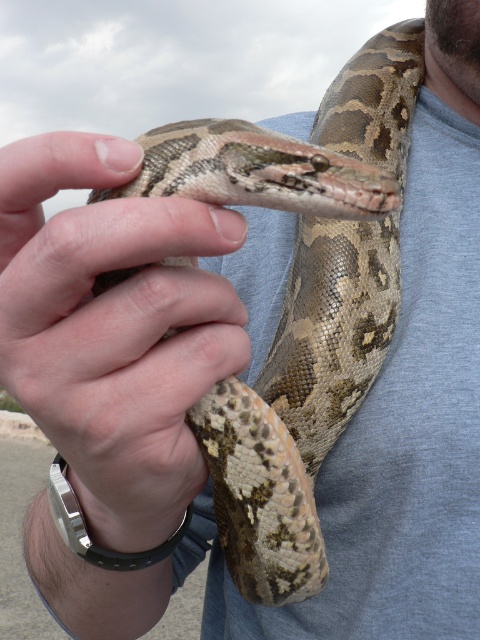
Does point (231, 232) come in front of point (450, 97)?

Yes.

Can you confirm if leathery tan snake at center is thinner than skinny neck at upper center?

In fact, leathery tan snake at center might be wider than skinny neck at upper center.

The image size is (480, 640). I want to click on leathery tan snake at center, so click(113, 330).

You are a GUI agent. You are given a task and a screenshot of the screen. Output one action in this format:
    pyautogui.click(x=<x>, y=<y>)
    Task: Click on the leathery tan snake at center
    The width and height of the screenshot is (480, 640).
    Given the screenshot: What is the action you would take?
    pyautogui.click(x=113, y=330)

Is camouflage-patterned snake at center to the left of leathery tan snake at center from the viewer's perspective?

Incorrect, camouflage-patterned snake at center is not on the left side of leathery tan snake at center.

Does point (299, 556) lie behind point (86, 298)?

Yes, point (299, 556) is farther from viewer.

At what (x,y) coordinates should I click in order to perform the action: click on camouflage-patterned snake at center. Please return your answer as a coordinate pair (x, y). The image size is (480, 640). Looking at the image, I should click on (300, 300).

Between camouflage-patterned snake at center and skinny neck at upper center, which one is positioned lower?

camouflage-patterned snake at center is below.

Locate an element on the screen. The height and width of the screenshot is (640, 480). camouflage-patterned snake at center is located at coordinates (300, 300).

Which is in front, point (269, 557) or point (460, 115)?

Point (269, 557)

At what (x,y) coordinates should I click in order to perform the action: click on camouflage-patterned snake at center. Please return your answer as a coordinate pair (x, y). Image resolution: width=480 pixels, height=640 pixels. Looking at the image, I should click on (300, 300).